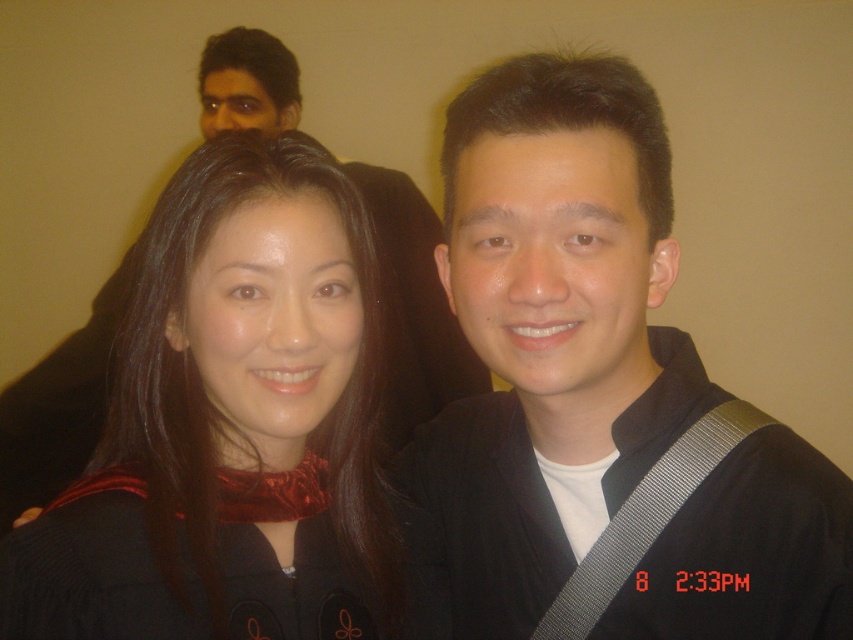
Question: Does velvet black dress at center lie behind black matte robe at center?

Choices:
 (A) no
 (B) yes

Answer: (B)

Question: Which object appears farthest from the camera in this image?

Choices:
 (A) black matte robe at center
 (B) velvet black dress at center

Answer: (B)

Question: Does velvet black dress at center appear under black matte robe at center?

Choices:
 (A) yes
 (B) no

Answer: (B)

Question: Which point is closer to the camera?

Choices:
 (A) velvet-like black robe at lower left
 (B) black matte robe at center

Answer: (B)

Question: Among these objects, which one is farthest from the camera?

Choices:
 (A) velvet-like black robe at lower left
 (B) velvet black dress at center
 (C) black matte robe at center

Answer: (A)

Question: Considering the relative positions of velvet black dress at center and velvet-like black robe at lower left in the image provided, where is velvet black dress at center located with respect to velvet-like black robe at lower left?

Choices:
 (A) right
 (B) left

Answer: (B)